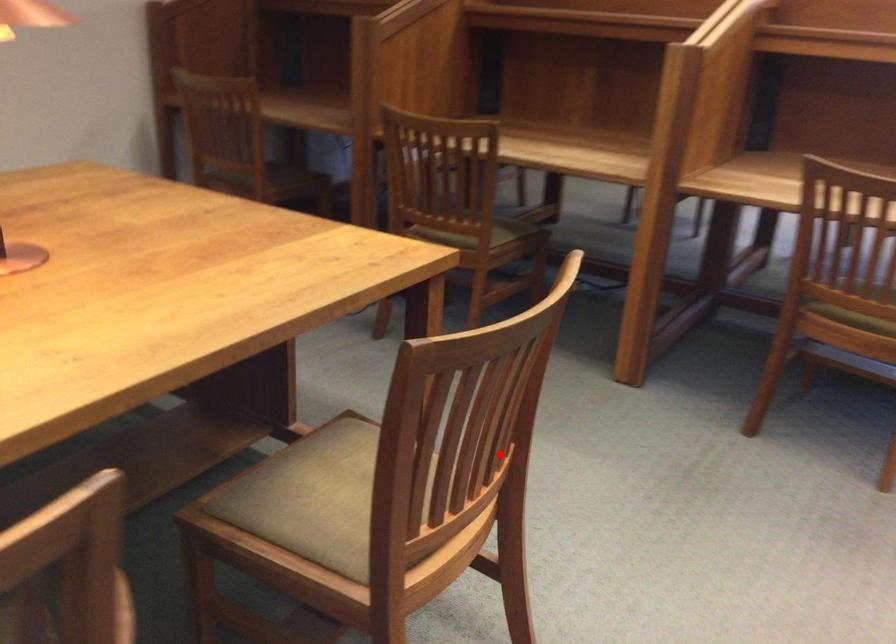
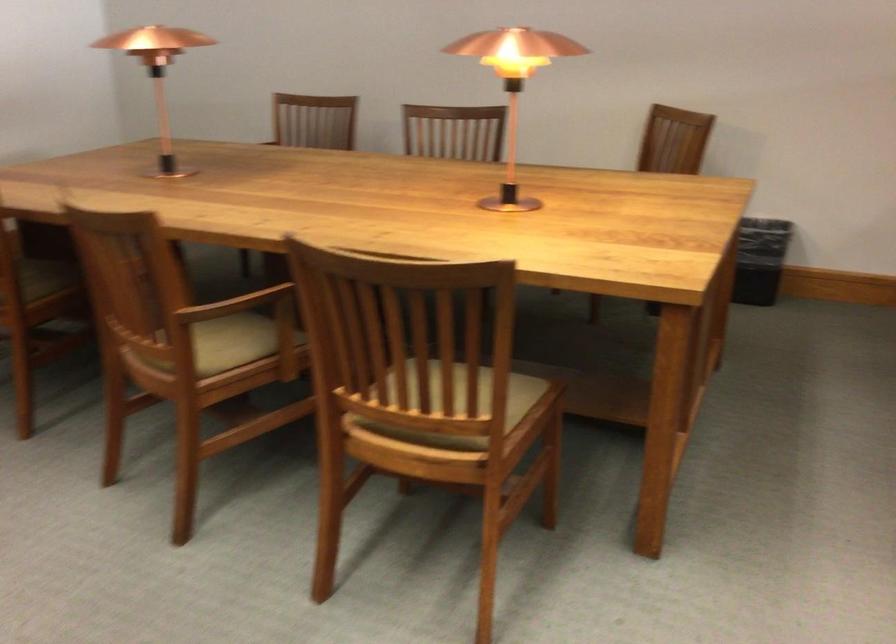
Question: I am providing you with two images of the same scene from different viewpoints. Image1 has a red point marked. In image2, the corresponding 3D location appears at what relative position? Reply with the corresponding letter.

Choices:
 (A) Closer
 (B) Farther

Answer: (B)